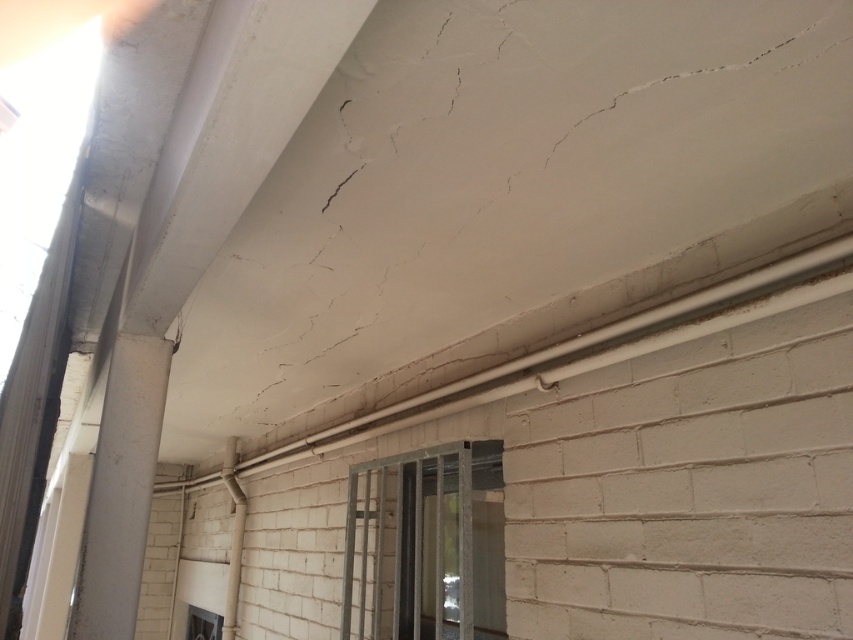
Question: Does metallic gray window at center come behind transparent glass window at lower left?

Choices:
 (A) no
 (B) yes

Answer: (A)

Question: Does metallic gray window at center have a smaller size compared to transparent glass window at lower left?

Choices:
 (A) yes
 (B) no

Answer: (B)

Question: Is metallic gray window at center thinner than transparent glass window at lower left?

Choices:
 (A) no
 (B) yes

Answer: (A)

Question: Which point appears closest to the camera in this image?

Choices:
 (A) (215, 620)
 (B) (474, 604)

Answer: (B)